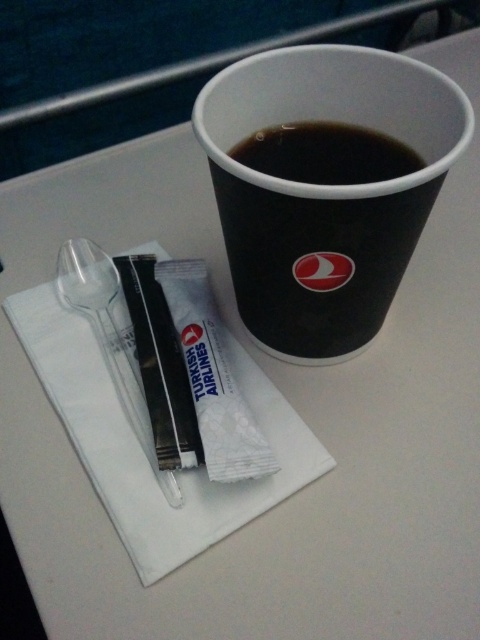
Which is above, black paper cup at upper center or black matte cup at upper center?

black matte cup at upper center is higher up.

This screenshot has height=640, width=480. What are the coordinates of `black paper cup at upper center` in the screenshot? It's located at (325, 189).

What do you see at coordinates (110, 339) in the screenshot?
I see `transparent plastic spoon at left` at bounding box center [110, 339].

Is point (73, 273) positioned behind point (236, 157)?

Yes, it is.

This screenshot has height=640, width=480. I want to click on transparent plastic spoon at left, so click(x=110, y=339).

Is point (241, 202) closer to viewer compared to point (111, 374)?

Yes, point (241, 202) is closer to viewer.

Does black paper cup at upper center appear over transparent plastic spoon at left?

Yes, black paper cup at upper center is above transparent plastic spoon at left.

Which is in front, point (253, 118) or point (116, 305)?

Positioned in front is point (253, 118).

Where is `black paper cup at upper center`? black paper cup at upper center is located at coordinates (325, 189).